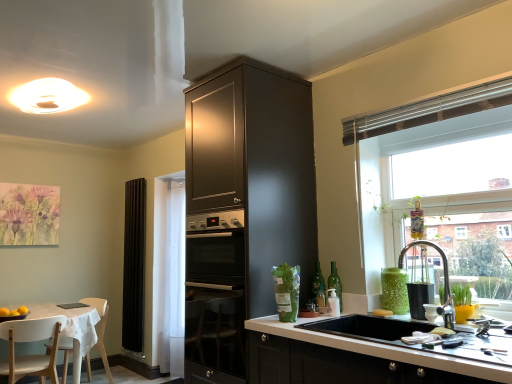
Question: In the image, is matte dark wood cabinet at center on the left side or the right side of black fabric curtain at left?

Choices:
 (A) left
 (B) right

Answer: (B)

Question: Considering the positions of point (216, 183) and point (135, 201), is point (216, 183) closer or farther from the camera than point (135, 201)?

Choices:
 (A) closer
 (B) farther

Answer: (A)

Question: Which object is the closest to the green glass bottle at right, the 1th bottle when ordered from right to left?

Choices:
 (A) watercolor flowers at upper left
 (B) white plastic chair at lower left, acting as the 1th chair starting from the back
 (C) white wood chair at lower left, which is the first chair from front to back
 (D) transparent glass window at upper right
 (E) matte dark wood cabinet at center

Answer: (E)

Question: Which object is positioned closest to the green glass bottle at right, marked as the 2th bottle in a right-to-left arrangement?

Choices:
 (A) white glossy vase at lower right
 (B) yellow matte soap at sink
 (C) matte white light fixture at upper center
 (D) matte dark wood cabinet at center
 (E) white plastic chair at lower left, the 2th chair in the front-to-back sequence

Answer: (B)